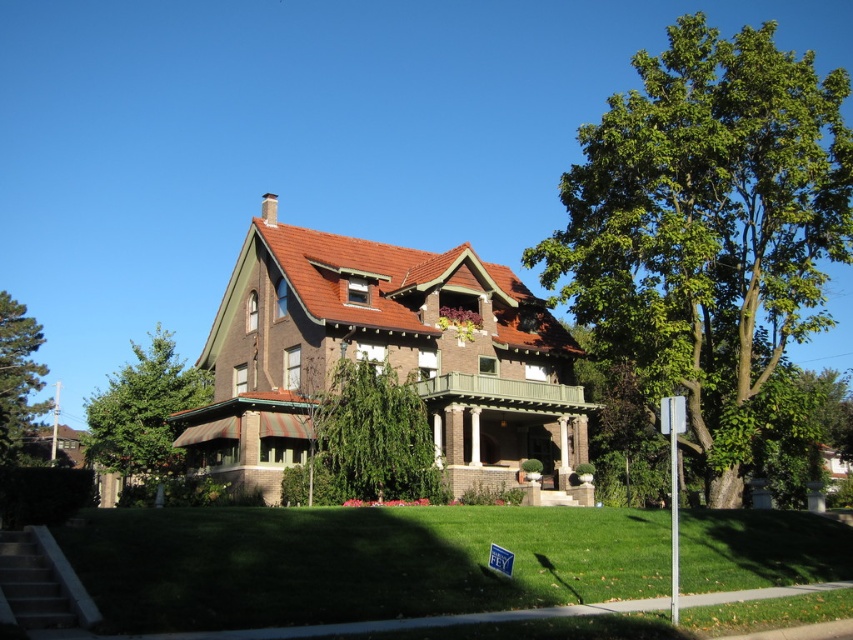
Question: Does green leafy tree at upper right appear on the right side of green leafy tree at left?

Choices:
 (A) no
 (B) yes

Answer: (B)

Question: Which object appears farthest from the camera in this image?

Choices:
 (A) green pine tree at left
 (B) green leafy tree at upper right

Answer: (A)

Question: Is green leafy tree at center behind green pine tree at left?

Choices:
 (A) yes
 (B) no

Answer: (B)

Question: Which point is farther to the camera?

Choices:
 (A) pos(180,458)
 (B) pos(717,147)
 (C) pos(41,384)
 (D) pos(399,404)

Answer: (C)

Question: Which object is closer to the camera taking this photo?

Choices:
 (A) green leafy tree at center
 (B) green leafy tree at upper right
 (C) green pine tree at left
 (D) green leafy tree at left

Answer: (A)

Question: Can you confirm if green leafy tree at center is positioned to the left of green pine tree at left?

Choices:
 (A) no
 (B) yes

Answer: (A)